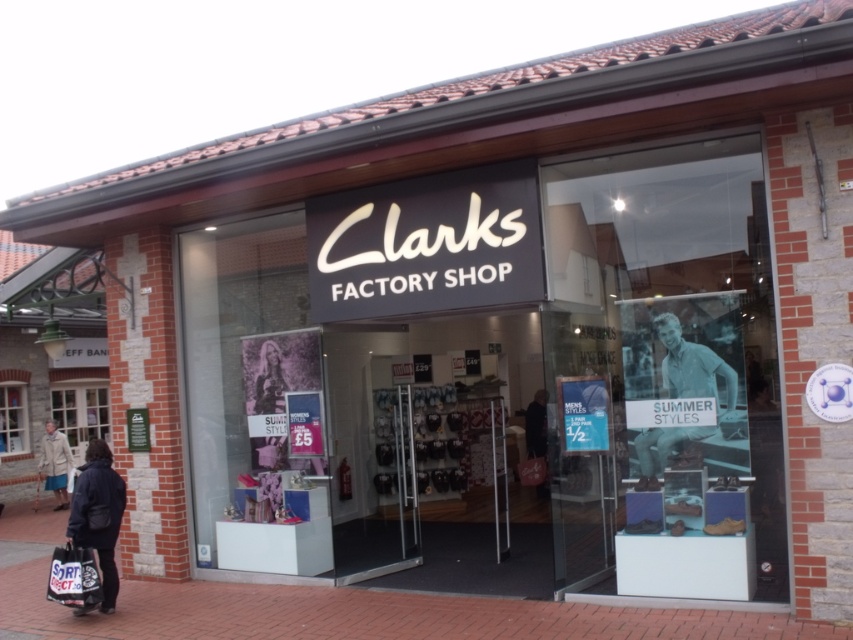
You are a customer standing at the entrance of Clarks Factory Shop and you see the light blue denim jeans at center and the dark blue coat at lower left. Which item is wider?

The light blue denim jeans at center might be wider than dark blue coat at lower left according to the description.

You are a customer entering the Clarks Factory Shop and notice the brick pavement at lower center and the dark blue coat at lower left. Which object takes up more space in the image?

The dark blue coat at lower left takes up more space in the image than the brick pavement at lower center because the brick pavement at lower center occupies less space than dark blue coat at lower left.

You are a customer standing outside the Clarks Factory Shop and looking through the large glass doors. You see the brick pavement at lower center and the light blue denim jeans at center. Which object is taller when viewed from the outside?

The light blue denim jeans at center are taller than the brick pavement at lower center because the brick pavement at lower center is not as tall as light blue denim jeans at center.